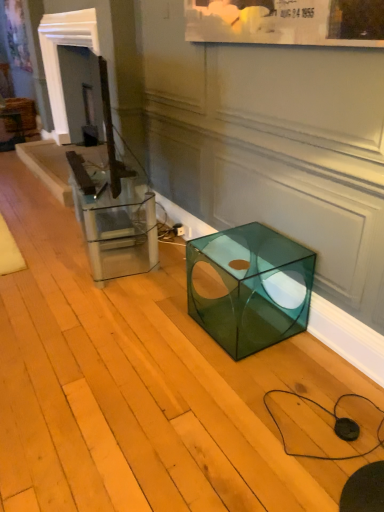
Identify the location of vacant region in front of transparent green cube at lower right. Image resolution: width=384 pixels, height=512 pixels. (255, 391).